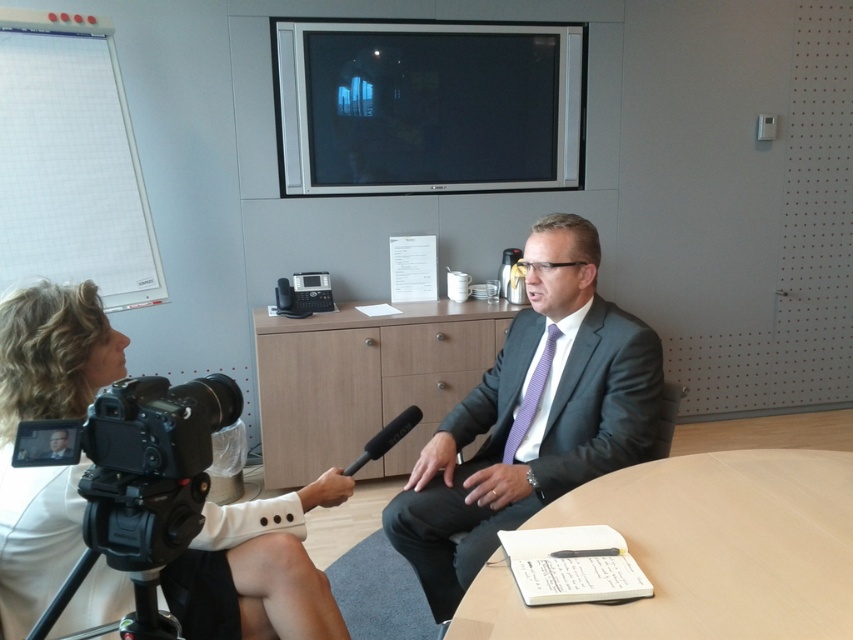
Question: Which point is farther to the camera?

Choices:
 (A) (828, 465)
 (B) (91, 333)
 (C) (511, 436)

Answer: (C)

Question: Can you confirm if black plastic video camera at lower left is thinner than purple striped tie at center?

Choices:
 (A) no
 (B) yes

Answer: (A)

Question: Does light brown wooden round table at center have a smaller size compared to wooden table at center?

Choices:
 (A) no
 (B) yes

Answer: (B)

Question: Estimate the real-world distances between objects in this image. Which object is farther from the wooden table at center?

Choices:
 (A) dark gray suit at center
 (B) purple striped tie at center

Answer: (B)

Question: Is dark gray suit at center to the left of purple striped tie at center from the viewer's perspective?

Choices:
 (A) no
 (B) yes

Answer: (B)

Question: Estimate the real-world distances between objects in this image. Which object is closer to the light brown wooden round table at center?

Choices:
 (A) wooden table at center
 (B) dark gray suit at center
 (C) black plastic tripod at lower left
 (D) white fabric camera at lower left

Answer: (B)